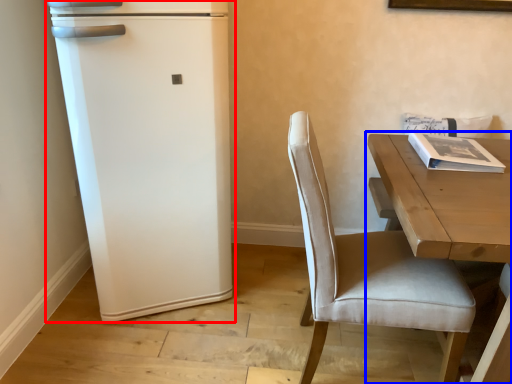
Question: Which object appears farthest to the camera in this image, refrigerator (highlighted by a red box) or table (highlighted by a blue box)?

Choices:
 (A) refrigerator
 (B) table

Answer: (A)